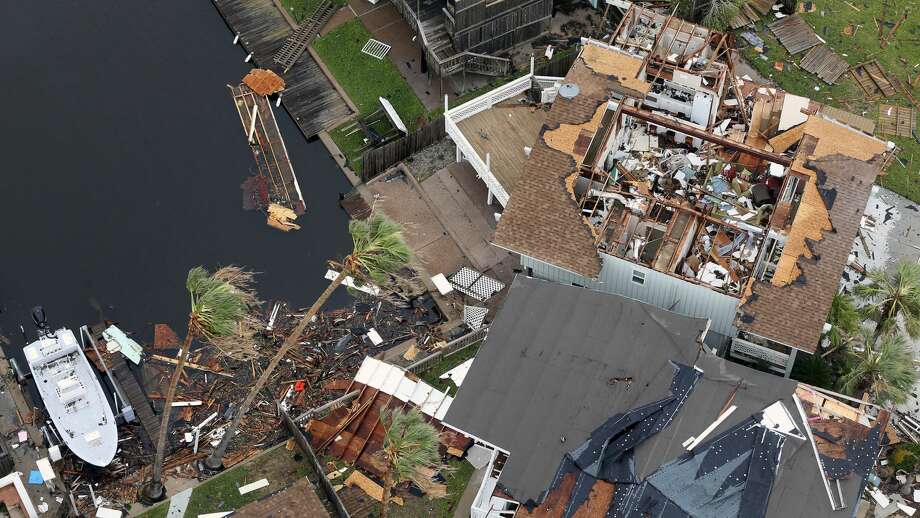
Locate an element on the screen. The image size is (920, 518). window is located at coordinates (633, 277).